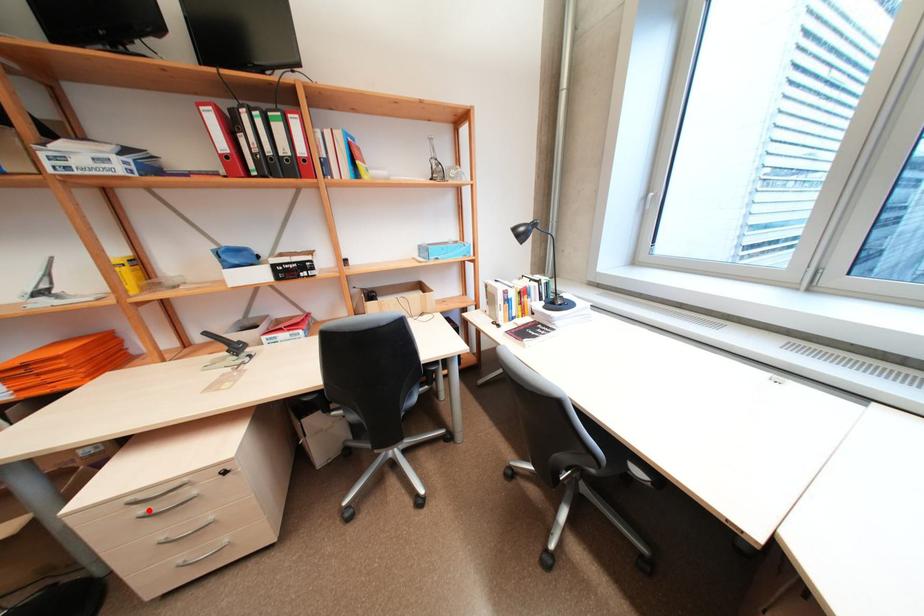
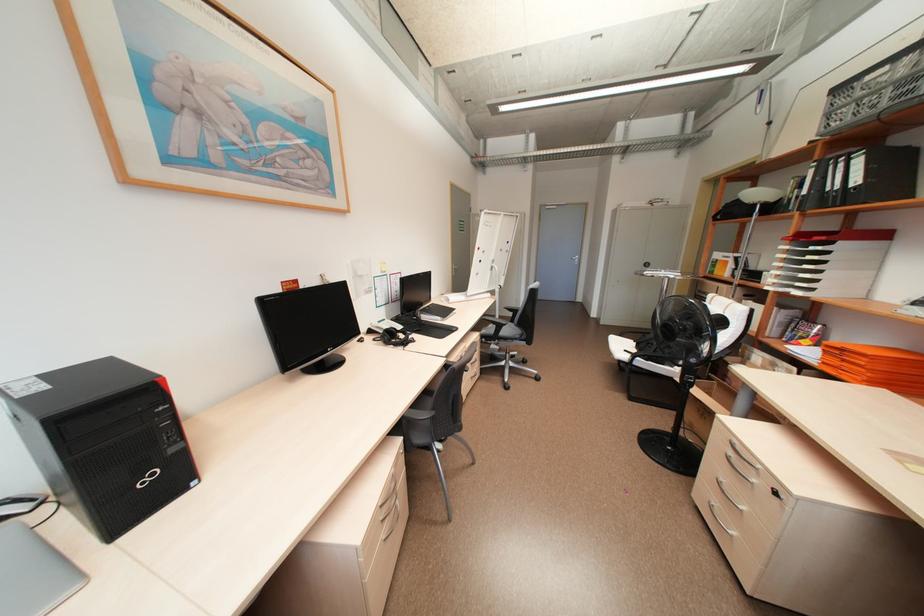
Question: I am providing you with two images of the same scene from different viewpoints. Image1 has a red point marked. In image2, the corresponding 3D location appears at what relative position? Reply with the corresponding letter.

Choices:
 (A) Closer
 (B) Farther

Answer: (B)